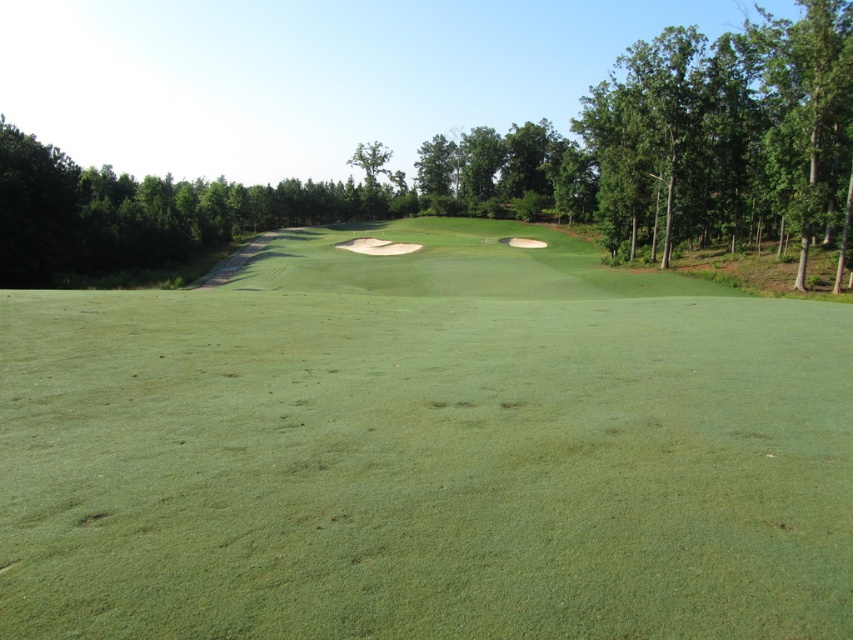
Question: Can you confirm if green grassy golf course at center is bigger than green leafy tree at center?

Choices:
 (A) yes
 (B) no

Answer: (B)

Question: Can you confirm if green grassy golf course at center is smaller than green leafy tree at center?

Choices:
 (A) no
 (B) yes

Answer: (B)

Question: Among these points, which one is farthest from the camera?

Choices:
 (A) (593, 92)
 (B) (265, 276)

Answer: (A)

Question: Which point is farther to the camera?

Choices:
 (A) (222, 211)
 (B) (51, 404)

Answer: (A)

Question: Can you confirm if green grassy golf course at center is wider than green leafy tree at center?

Choices:
 (A) no
 (B) yes

Answer: (A)